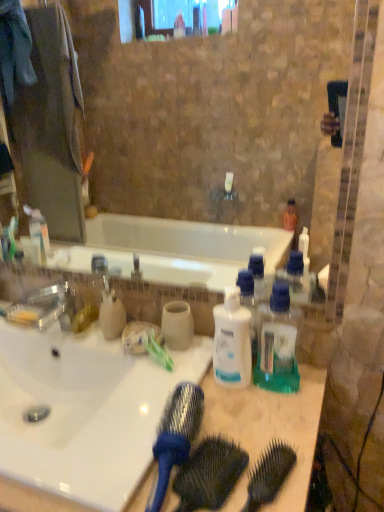
Question: Is translucent green plastic at center, the 1th bottle positioned from the right, located outside white plastic bottle at center, the 2th bottle from the right?

Choices:
 (A) yes
 (B) no

Answer: (A)

Question: Is translucent green plastic at center, which appears as the 2th bottle when viewed from the left, positioned before white plastic bottle at center, which is the 1th bottle in left-to-right order?

Choices:
 (A) no
 (B) yes

Answer: (B)

Question: Is white plastic bottle at center, which is the 1th bottle in left-to-right order, inside translucent green plastic at center, which appears as the 2th bottle when viewed from the left?

Choices:
 (A) yes
 (B) no

Answer: (B)

Question: Could you tell me if translucent green plastic at center, the 1th bottle positioned from the right, is turned towards white plastic bottle at center, which is the 1th bottle in left-to-right order?

Choices:
 (A) no
 (B) yes

Answer: (A)

Question: Is white plastic bottle at center, the 2th bottle from the right, at the back of translucent green plastic at center, the 1th bottle positioned from the right?

Choices:
 (A) no
 (B) yes

Answer: (A)

Question: Is black plastic brush at center, acting as the 1th brush starting from the right, taller or shorter than blue plastic comb at center?

Choices:
 (A) tall
 (B) short

Answer: (B)

Question: From the image's perspective, relative to blue plastic comb at center, is black plastic brush at center, marked as the second brush in a left-to-right arrangement, above or below?

Choices:
 (A) above
 (B) below

Answer: (A)

Question: Is black plastic brush at center, acting as the 1th brush starting from the right, bigger or smaller than blue plastic comb at center?

Choices:
 (A) small
 (B) big

Answer: (A)

Question: Considering the positions of point (251, 480) and point (205, 481), is point (251, 480) closer or farther from the camera than point (205, 481)?

Choices:
 (A) farther
 (B) closer

Answer: (A)

Question: Would you say translucent green plastic at center, the 1th bottle positioned from the right, is to the left or to the right of white plastic bottle at center, the 2th bottle from the right, in the picture?

Choices:
 (A) left
 (B) right

Answer: (B)

Question: In terms of size, does translucent green plastic at center, the 1th bottle positioned from the right, appear bigger or smaller than white plastic bottle at center, the 2th bottle from the right?

Choices:
 (A) small
 (B) big

Answer: (B)

Question: From the image's perspective, is translucent green plastic at center, which appears as the 2th bottle when viewed from the left, above or below white plastic bottle at center, the 2th bottle from the right?

Choices:
 (A) above
 (B) below

Answer: (A)

Question: Is translucent green plastic at center, the 1th bottle positioned from the right, wider or thinner than white plastic bottle at center, which is the 1th bottle in left-to-right order?

Choices:
 (A) thin
 (B) wide

Answer: (B)

Question: Is white plastic bottle at center, which is the 1th bottle in left-to-right order, bigger or smaller than matte beige soap dispenser at center-left?

Choices:
 (A) big
 (B) small

Answer: (A)

Question: Would you say white plastic bottle at center, the 2th bottle from the right, is to the left or to the right of matte beige soap dispenser at center-left in the picture?

Choices:
 (A) left
 (B) right

Answer: (B)